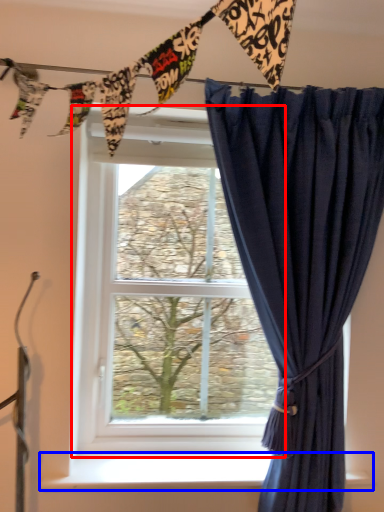
Question: Which object appears closest to the camera in this image, window (highlighted by a red box) or window sill (highlighted by a blue box)?

Choices:
 (A) window
 (B) window sill

Answer: (B)